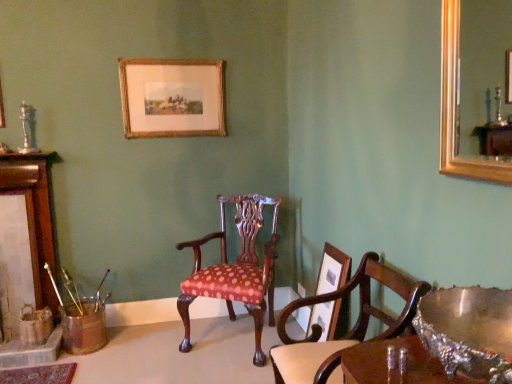
You are a GUI agent. You are given a task and a screenshot of the screen. Output one action in this format:
    pyautogui.click(x=<x>, y=<y>)
    Task: Click on the vacant location below polka dot fabric chair at center, which ranks as the 1th chair in back-to-front order (from a real-world perspective)
    
    Given the screenshot: What is the action you would take?
    pyautogui.click(x=222, y=339)